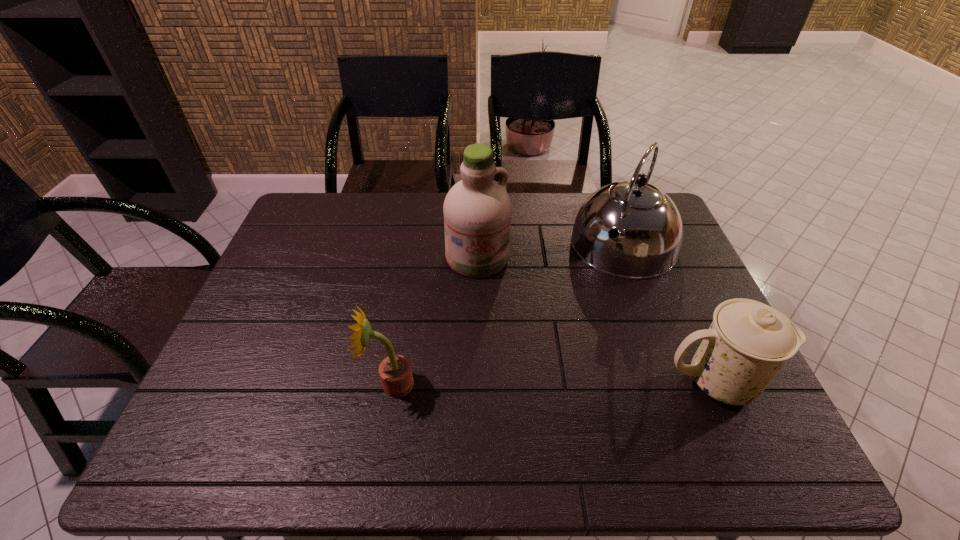
Locate an element on the screen. This screenshot has height=540, width=960. vacant space on the desktop that is between the sunflower and the chinaware and is positioned on the front label of the cleansing agent is located at coordinates (519, 383).

Locate an element on the screen. This screenshot has width=960, height=540. free spot on the desktop that is between the sunflower and the chinaware and is positioned from the spout of the kettle is located at coordinates (538, 383).